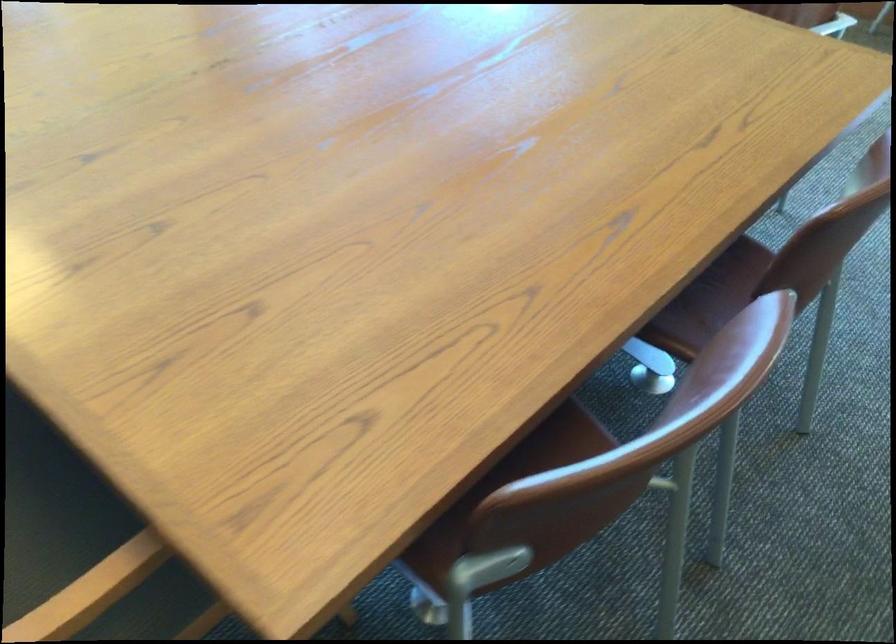
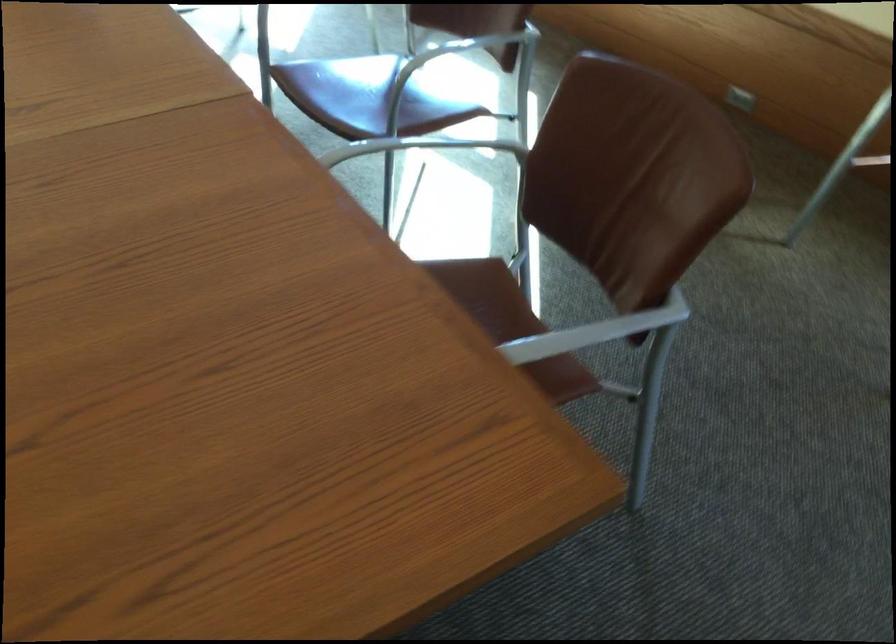
Which direction would the cameraman need to move to produce the second image?

The movement direction of the cameraman is right, forward.